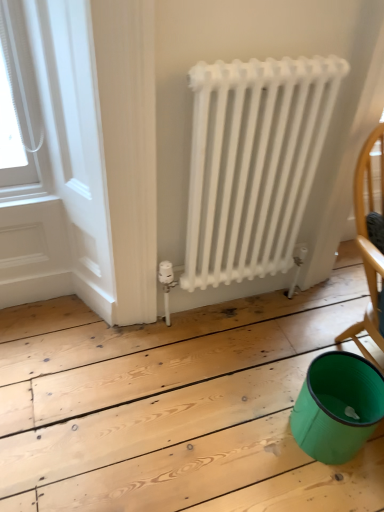
Locate an element on the screen. The width and height of the screenshot is (384, 512). white matte radiator at center is located at coordinates coord(253,163).

The image size is (384, 512). Describe the element at coordinates (368, 242) in the screenshot. I see `wooden chair at right` at that location.

Find the location of a particular element. white painted wood at upper left is located at coordinates (55, 161).

You are a GUI agent. You are given a task and a screenshot of the screen. Output one action in this format:
    pyautogui.click(x=<x>, y=<y>)
    Task: Click on the chair on the right of teal plastic bucket at lower right
    
    Given the screenshot: What is the action you would take?
    pyautogui.click(x=368, y=242)

From their relative heights in the image, would you say teal plastic bucket at lower right is taller or shorter than wooden chair at right?

Clearly, teal plastic bucket at lower right is shorter compared to wooden chair at right.

Could wooden chair at right be considered to be inside teal plastic bucket at lower right?

No, wooden chair at right is not inside teal plastic bucket at lower right.

In the scene shown: From the image's perspective, does teal plastic bucket at lower right appear lower than wooden chair at right?

Yes, from the image's perspective, teal plastic bucket at lower right is below wooden chair at right.

From a real-world perspective, is white matte radiator at center physically located above or below wooden chair at right?

Clearly, from a real-world perspective, white matte radiator at center is below wooden chair at right.

From the image's perspective, is white matte radiator at center positioned above or below wooden chair at right?

white matte radiator at center is above wooden chair at right.

Can you tell me how much white matte radiator at center and wooden chair at right differ in facing direction?

The angle between the facing direction of white matte radiator at center and the facing direction of wooden chair at right is 2.72 degrees.

Is white matte radiator at center not inside wooden chair at right?

white matte radiator at center lies outside wooden chair at right's area.

Does wooden chair at right have a lesser height compared to teal plastic bucket at lower right?

Incorrect, the height of wooden chair at right does not fall short of that of teal plastic bucket at lower right.

In the scene shown: Is teal plastic bucket at lower right inside wooden chair at right?

That's incorrect, teal plastic bucket at lower right is not inside wooden chair at right.

Is wooden chair at right thinner than teal plastic bucket at lower right?

Indeed, wooden chair at right has a lesser width compared to teal plastic bucket at lower right.

From the image's perspective, is white painted wood at upper left below white matte radiator at center?

Yes.

Considering the relative sizes of white painted wood at upper left and white matte radiator at center in the image provided, is white painted wood at upper left smaller than white matte radiator at center?

Correct, white painted wood at upper left occupies less space than white matte radiator at center.

Which is more to the left, white painted wood at upper left or white matte radiator at center?

From the viewer's perspective, white painted wood at upper left appears more on the left side.

Is wooden chair at right bigger or smaller than white painted wood at upper left?

Considering their sizes, wooden chair at right takes up less space than white painted wood at upper left.

You are a GUI agent. You are given a task and a screenshot of the screen. Output one action in this format:
    pyautogui.click(x=<x>, y=<y>)
    Task: Click on the chair below the white painted wood at upper left (from a real-world perspective)
    The image size is (384, 512).
    Given the screenshot: What is the action you would take?
    pyautogui.click(x=368, y=242)

Is wooden chair at right to the right of white painted wood at upper left from the viewer's perspective?

Indeed, wooden chair at right is positioned on the right side of white painted wood at upper left.

Considering the sizes of objects wooden chair at right and white painted wood at upper left in the image provided, who is shorter, wooden chair at right or white painted wood at upper left?

With less height is wooden chair at right.

From a real-world perspective, is white painted wood at upper left on top of teal plastic bucket at lower right?

Yes.

Is white painted wood at upper left beside teal plastic bucket at lower right?

There is a gap between white painted wood at upper left and teal plastic bucket at lower right.

Is teal plastic bucket at lower right completely or partially inside white painted wood at upper left?

Actually, teal plastic bucket at lower right is outside white painted wood at upper left.

Looking at their sizes, would you say white matte radiator at center is wider or thinner than teal plastic bucket at lower right?

In the image, white matte radiator at center appears to be more narrow than teal plastic bucket at lower right.

Is white matte radiator at center bigger or smaller than teal plastic bucket at lower right?

white matte radiator at center is bigger than teal plastic bucket at lower right.

Does white matte radiator at center appear on the right side of teal plastic bucket at lower right?

In fact, white matte radiator at center is to the left of teal plastic bucket at lower right.

In the image, there is a teal plastic bucket at lower right. Identify the location of chair above it (from the image's perspective). (368, 242).

Identify the location of radiator that is under the wooden chair at right (from a real-world perspective). (253, 163).

Estimate the real-world distances between objects in this image. Which object is closer to white matte radiator at center, teal plastic bucket at lower right or white painted wood at upper left?

Based on the image, white painted wood at upper left appears to be nearer to white matte radiator at center.

Based on their spatial positions, is teal plastic bucket at lower right or white painted wood at upper left closer to wooden chair at right?

Based on the image, teal plastic bucket at lower right appears to be nearer to wooden chair at right.

Estimate the real-world distances between objects in this image. Which object is closer to wooden chair at right, white painted wood at upper left or white matte radiator at center?

white matte radiator at center is closer to wooden chair at right.

Based on their spatial positions, is white matte radiator at center or wooden chair at right further from teal plastic bucket at lower right?

The object further to teal plastic bucket at lower right is white matte radiator at center.

When comparing their distances from wooden chair at right, does white matte radiator at center or teal plastic bucket at lower right seem closer?

teal plastic bucket at lower right lies closer to wooden chair at right than the other object.

Considering their positions, is white matte radiator at center positioned closer to wooden chair at right than white painted wood at upper left?

Based on the image, white matte radiator at center appears to be nearer to wooden chair at right.

Based on their spatial positions, is teal plastic bucket at lower right or wooden chair at right closer to white painted wood at upper left?

teal plastic bucket at lower right is positioned closer to the anchor white painted wood at upper left.

Which object lies nearer to the anchor point teal plastic bucket at lower right, white painted wood at upper left or white matte radiator at center?

white matte radiator at center.

At what (x,y) coordinates should I click in order to perform the action: click on chair between white matte radiator at center and teal plastic bucket at lower right from top to bottom. Please return your answer as a coordinate pair (x, y). Looking at the image, I should click on (368, 242).

Identify the location of radiator between white painted wood at upper left and teal plastic bucket at lower right in the horizontal direction. The width and height of the screenshot is (384, 512). (253, 163).

In order to click on radiator between white painted wood at upper left and wooden chair at right from left to right in this screenshot , I will do `click(253, 163)`.

You are a GUI agent. You are given a task and a screenshot of the screen. Output one action in this format:
    pyautogui.click(x=<x>, y=<y>)
    Task: Click on the teal between white painted wood at upper left and wooden chair at right in the horizontal direction
    This screenshot has height=512, width=384.
    Given the screenshot: What is the action you would take?
    pyautogui.click(x=337, y=406)